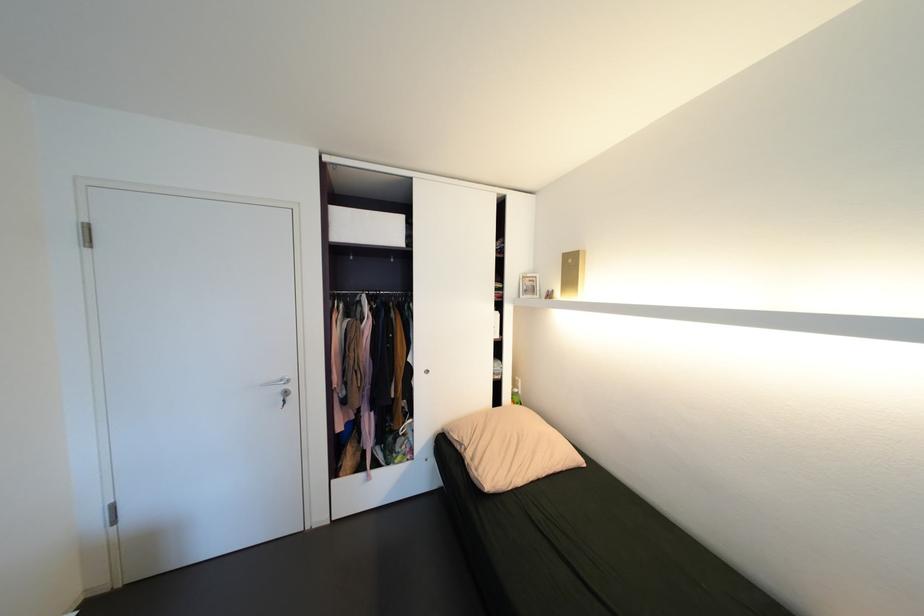
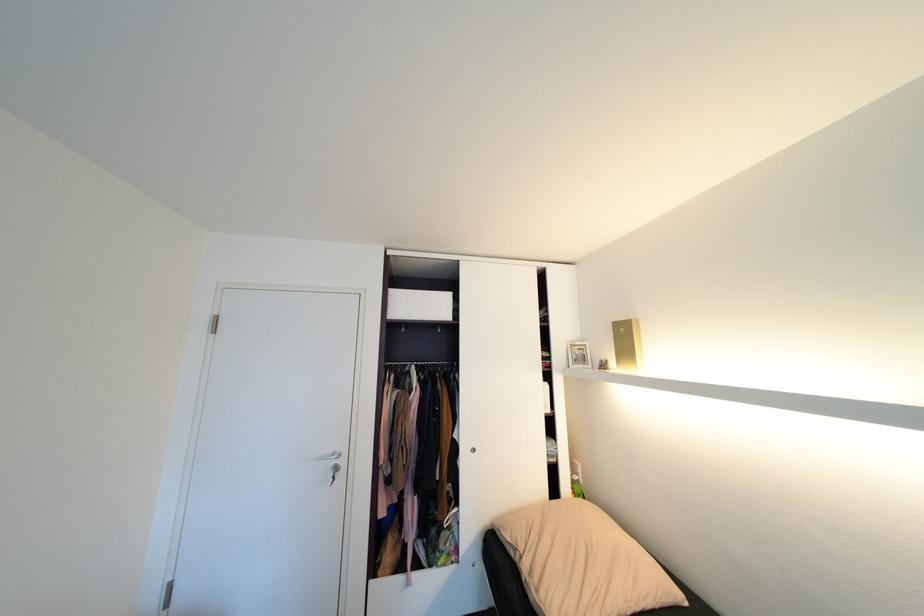
Find the pixel in the second image that matches (x=570, y=254) in the first image.

(621, 323)